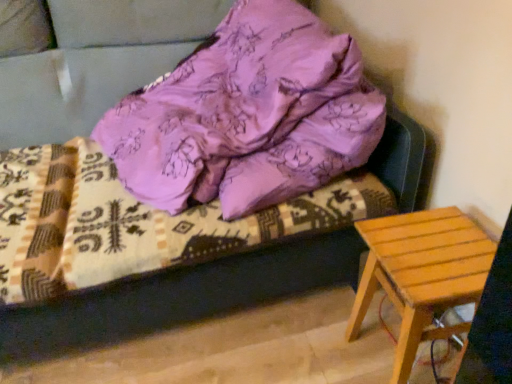
The width and height of the screenshot is (512, 384). Find the location of `vacant area on top of light brown wooden stool at lower right (from a real-world perspective)`. vacant area on top of light brown wooden stool at lower right (from a real-world perspective) is located at coordinates tap(435, 243).